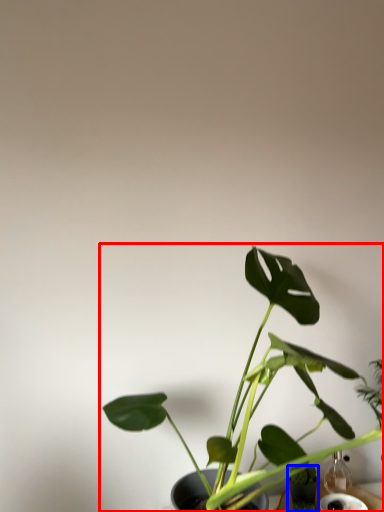
Question: Which object is closer to the camera taking this photo, houseplant (highlighted by a red box) or glass vase (highlighted by a blue box)?

Choices:
 (A) houseplant
 (B) glass vase

Answer: (A)